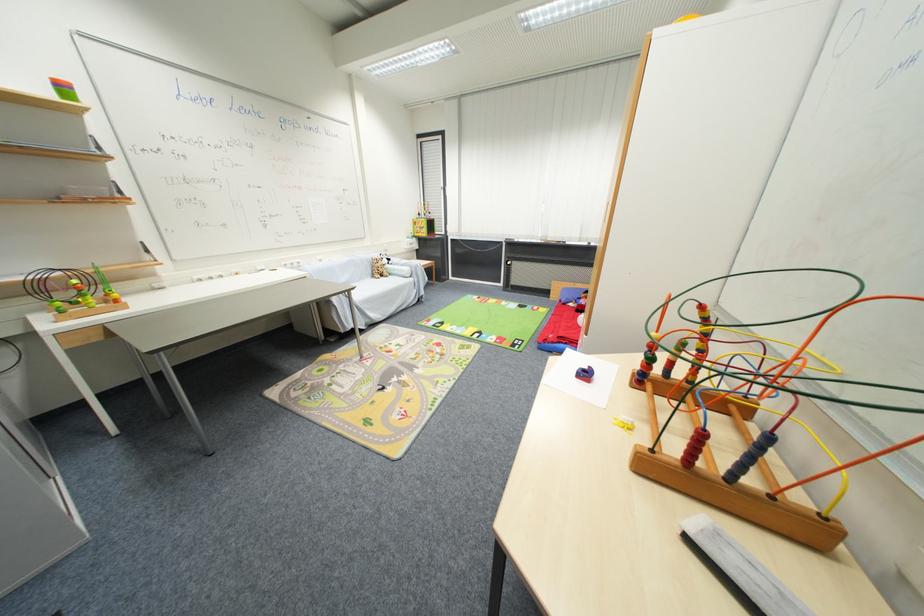
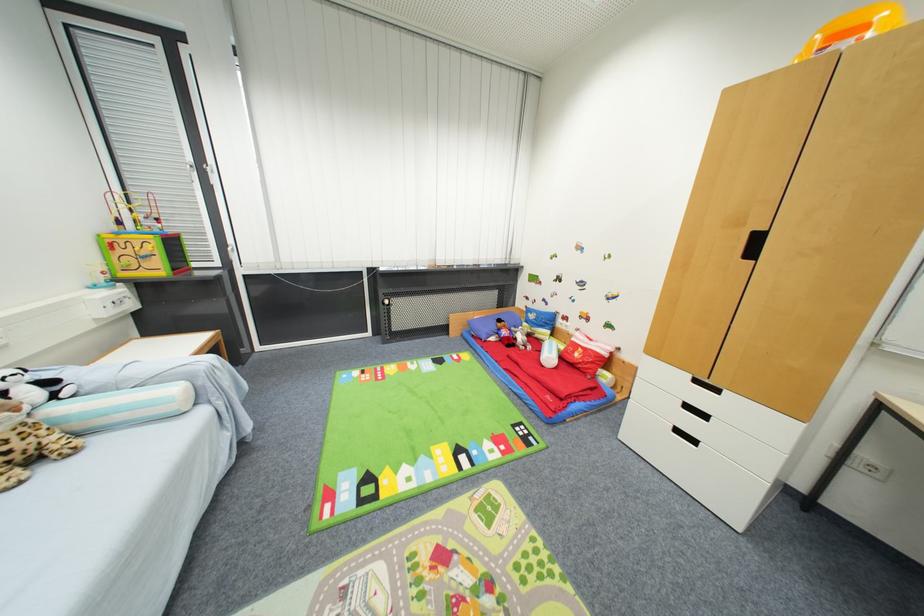
In the second image, find the point that corresponds to point (383, 274) in the first image.

(7, 456)